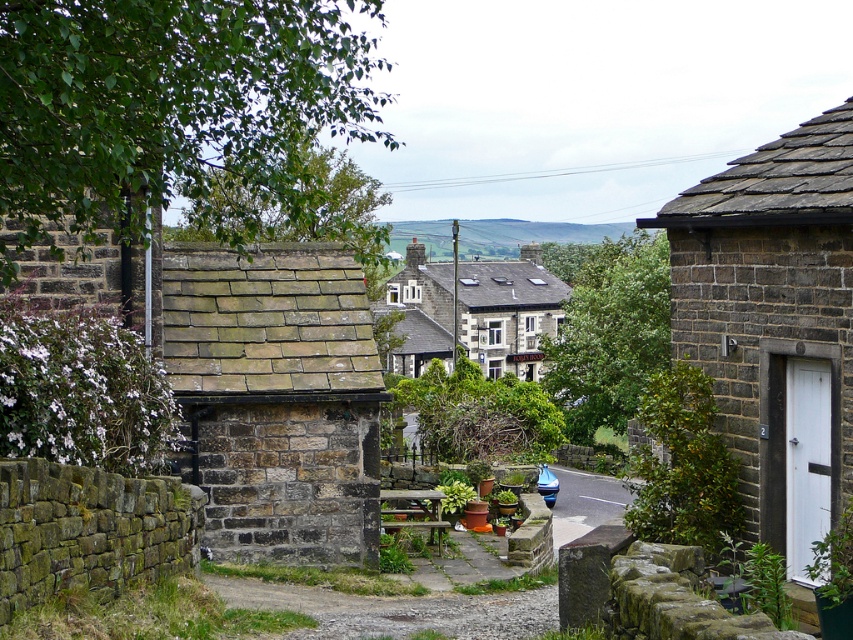
From the picture: You are planning to install a fence between the rustic stone cottage at left and the matte stone cottage at right. The fence requires a minimum of 40 feet of space between the two cottages to be installed safely. Based on the distance provided, can the fence be installed between them?

The rustic stone cottage at left is 38.21 feet from the matte stone cottage at right, which is less than the required 40 feet. Therefore, the fence cannot be safely installed between them.

You are planning to install a new satellite dish on the tallest structure between the rustic stone cottage at left and the dark gray stone cottage at center. Which one should you choose?

The dark gray stone cottage at center is taller than the rustic stone cottage at left, so you should install the satellite dish on the dark gray stone cottage at center.

You are standing at the entrance of the rustic stone cottage at left and want to walk to the dark gray stone cottage at center. Which direction should you head towards?

You should head towards the right because the rustic stone cottage at left is positioned on the left side of the dark gray stone cottage at center, meaning the dark gray stone cottage at center is to the right of the rustic stone cottage at left.